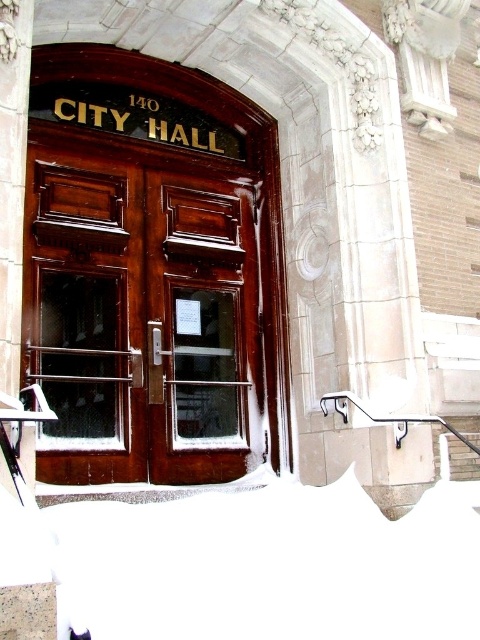
You are a delivery person trying to determine if your 1.5 meter wide package can fit through the entrance. The entrance has a shiny dark wood door at center and white fluffy snow at lower center. Based on their widths, can the package pass through the door?

The shiny dark wood door at center has a lesser width compared to white fluffy snow at lower center. Since the snow is wider than the door, and the package is 1.5 meters wide, it is uncertain if the door is wide enough. You should measure the door width before attempting to pass through.

You are a delivery person trying to deliver a package to the shiny dark wood door at center. There is white fluffy snow at lower center blocking the path. Can you reach the door without stepping on the snow?

The shiny dark wood door at center is larger in size than white fluffy snow at lower center, so yes, you can reach the door without stepping on the snow by moving around it since the snow is smaller in size.

You are a delivery person trying to reach the door at the entrance of 140 CITY HALL. You notice the shiny dark wood door at center and the white fluffy snow at lower center. Which object is taller?

The shiny dark wood door at center is much taller than the white fluffy snow at lower center.